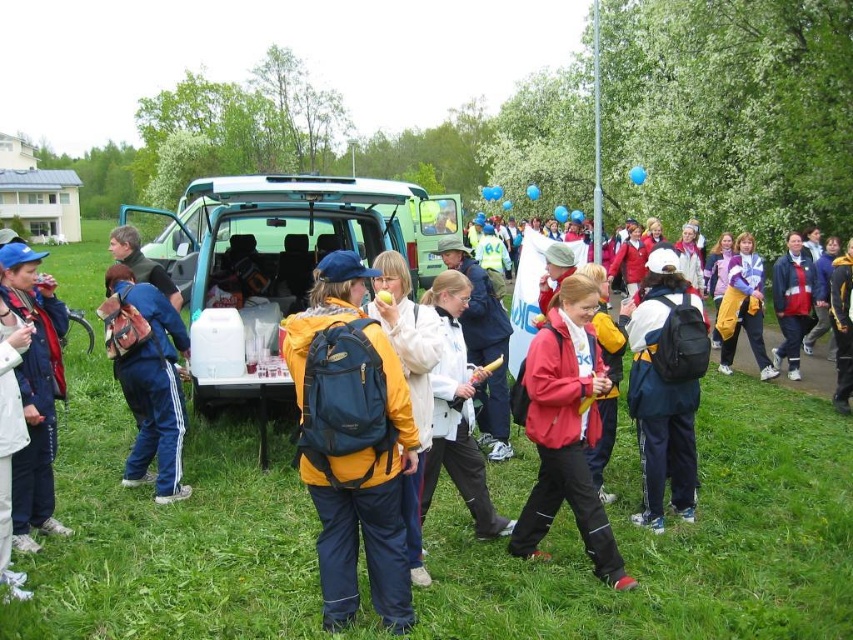
You are organizing a community event and need to set up a supply station. The green matte van at center is part of the setup. Considering the height of the van and the yellow fabric jacket at center, which object is better suited for hanging a banner from a pole placed between them?

The green matte van at center is taller than the yellow fabric jacket at center, so the banner should be hung from the pole near the green matte van at center to ensure it is visible and stable.

Consider the image. You are at the outdoor gathering and want to locate the refreshment van. You see a yellow fabric jacket at center. Where would you find the green matte van at center relative to the jacket?

The green matte van at center is to the left of the yellow fabric jacket at center.